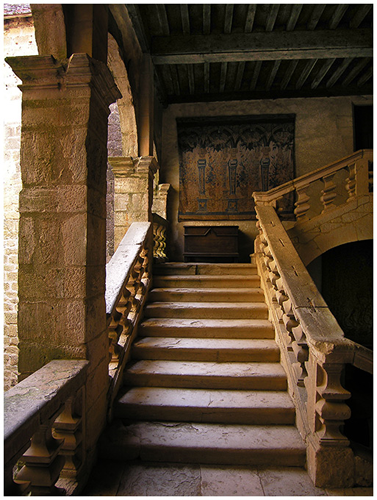
Locate an element on the screen. Image resolution: width=377 pixels, height=500 pixels. support beam is located at coordinates (237, 55).